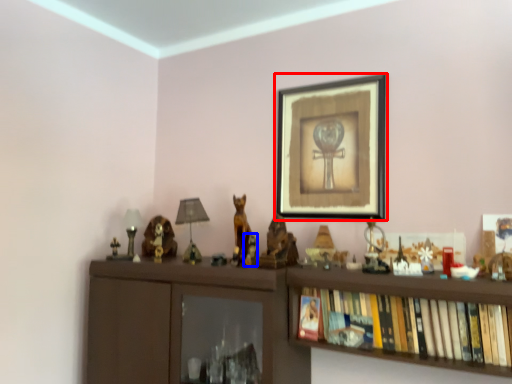
Question: Which point is further to the camera, picture frame (highlighted by a red box) or toy (highlighted by a blue box)?

Choices:
 (A) picture frame
 (B) toy

Answer: (B)